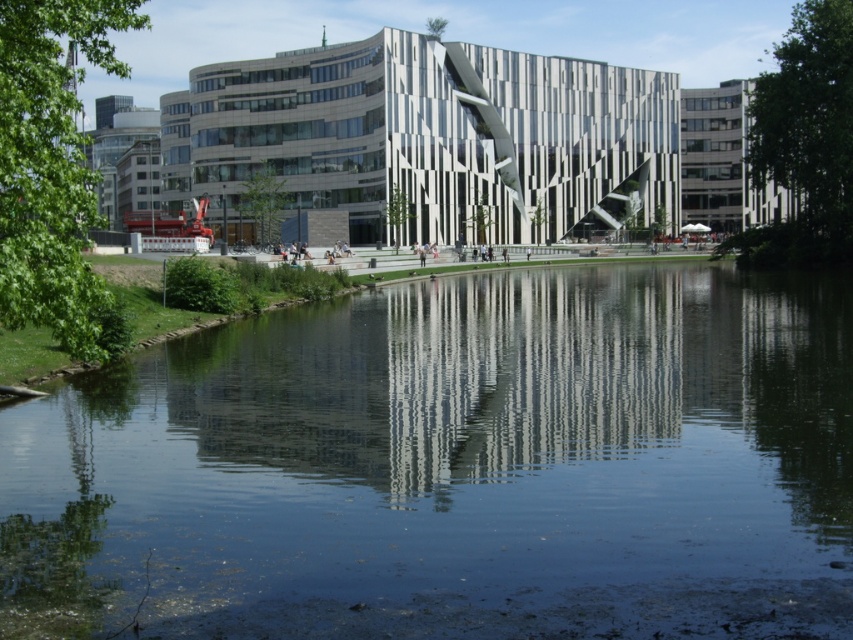
Which is above, transparent water at center or white striped building at center?

white striped building at center

Can you confirm if transparent water at center is positioned below white striped building at center?

Yes.

Identify the location of transparent water at center. (454, 467).